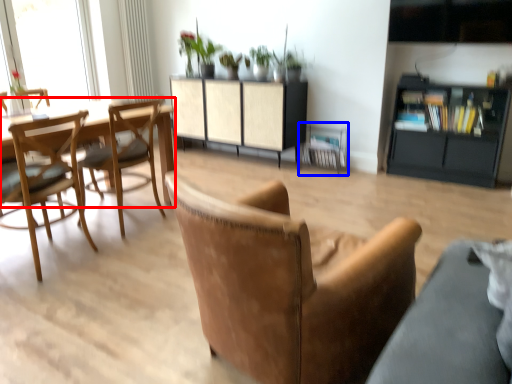
Question: Among these objects, which one is nearest to the camera, round table (highlighted by a red box) or armchair (highlighted by a blue box)?

Choices:
 (A) round table
 (B) armchair

Answer: (A)